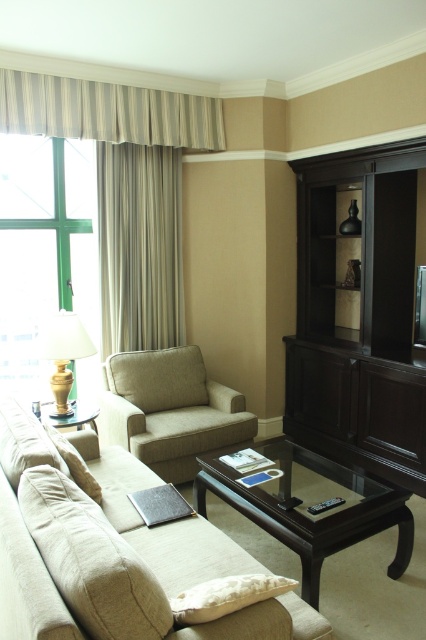
From the picture: How distant is beige fabric armchair at center from matte beige lamp at left?

They are 25.23 inches apart.

Between point (227, 424) and point (45, 353), which one is positioned behind?

Positioned behind is point (227, 424).

Identify the location of beige fabric armchair at center. (169, 410).

Who is higher up, silky beige curtain at left or matte wood side table at lower left?

silky beige curtain at left is higher up.

Which is more to the left, silky beige curtain at left or matte wood side table at lower left?

matte wood side table at lower left is more to the left.

Does point (123, 275) lie in front of point (77, 401)?

No, it is behind (77, 401).

The image size is (426, 640). What are the coordinates of `silky beige curtain at left` in the screenshot? It's located at (140, 246).

Consider the image. Which is more to the left, beige fabric couch at lower left or dark wood entertainment center at right?

Positioned to the left is beige fabric couch at lower left.

Does beige fabric couch at lower left have a lesser height compared to dark wood entertainment center at right?

Yes, beige fabric couch at lower left is shorter than dark wood entertainment center at right.

I want to click on beige fabric couch at lower left, so click(112, 552).

You are a GUI agent. You are given a task and a screenshot of the screen. Output one action in this format:
    pyautogui.click(x=<x>, y=<y>)
    Task: Click on the beige fabric couch at lower left
    The image size is (426, 640).
    Given the screenshot: What is the action you would take?
    pyautogui.click(x=112, y=552)